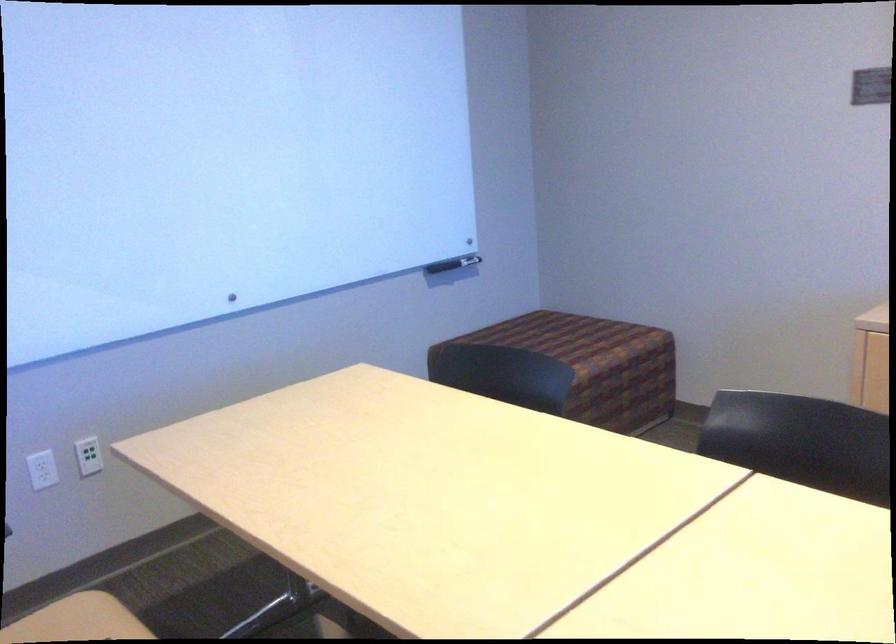
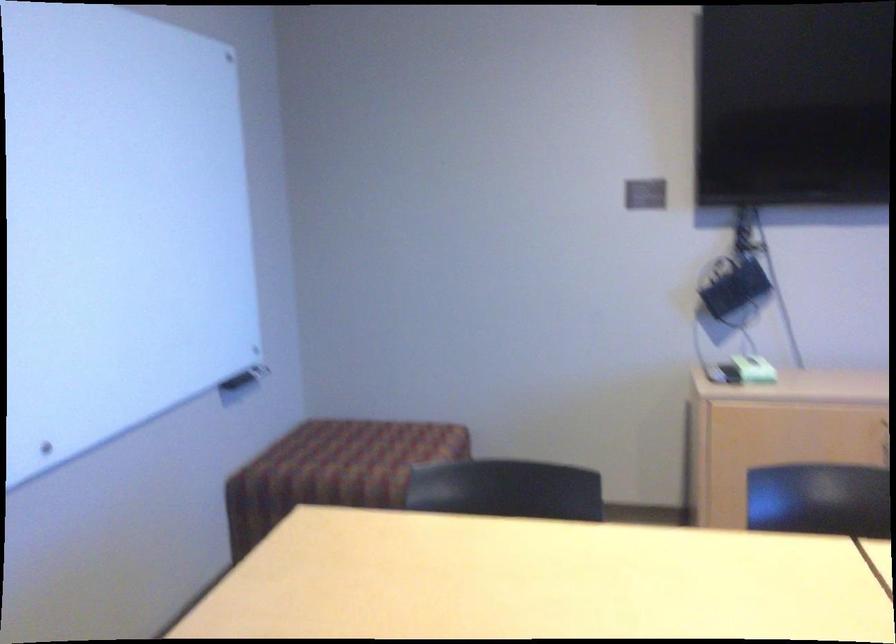
Where in the second image is the point corresponding to the point at 457,258 from the first image?

(246, 373)